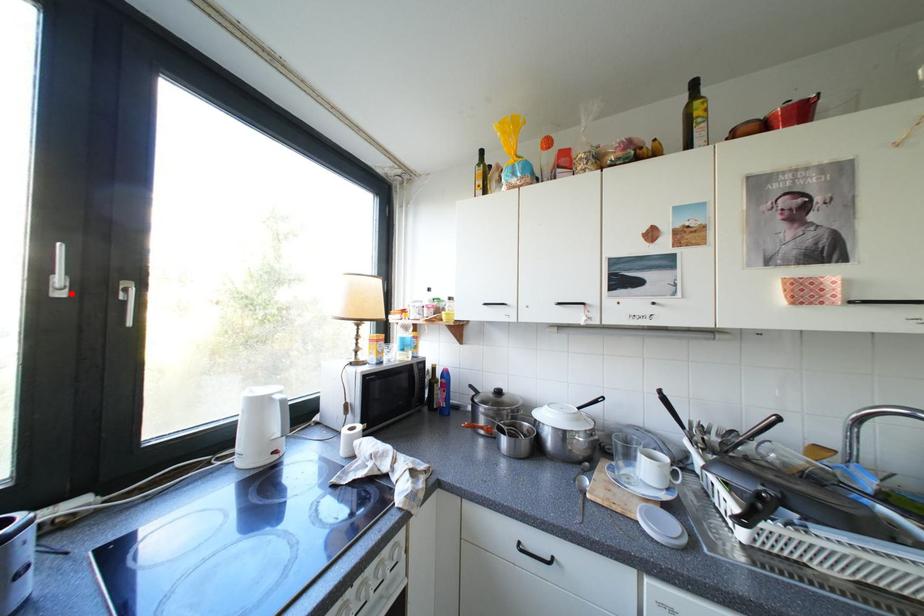
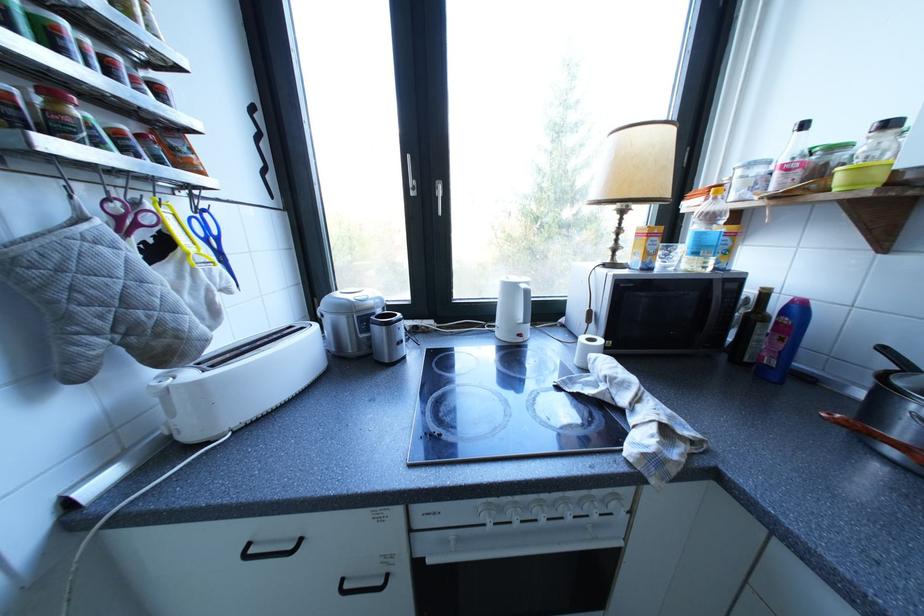
Question: I am providing you with two images of the same scene from different viewpoints. A red point is marked on the first image. Can you still see the location of the red point in image 2?

Choices:
 (A) Yes
 (B) No

Answer: (A)